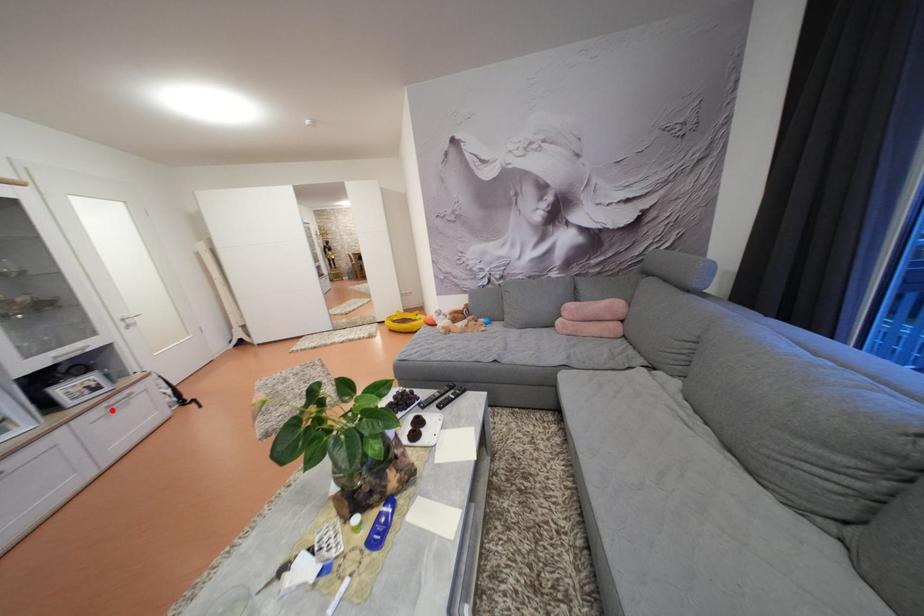
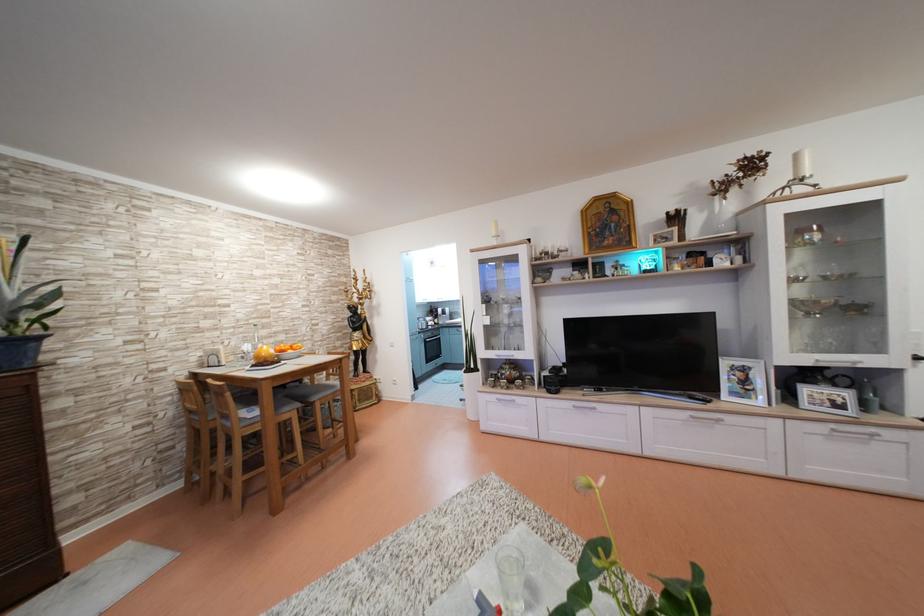
Find the pixel in the second image that matches the highlighted location in the first image.

(840, 431)